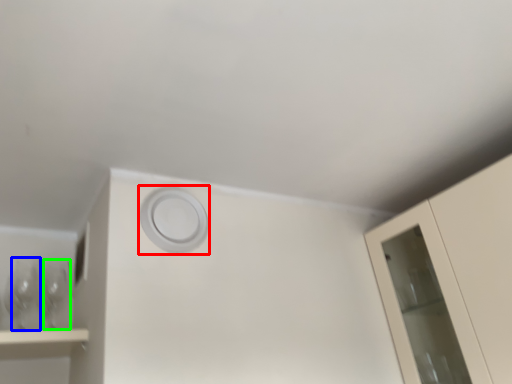
Question: Which object is positioned closest to circle (highlighted by a red box)? Select from wine glass (highlighted by a blue box) and wine glass (highlighted by a green box).

Choices:
 (A) wine glass
 (B) wine glass

Answer: (B)